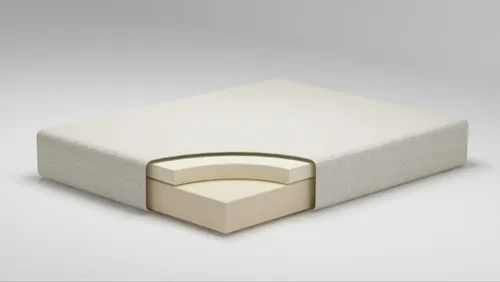
This screenshot has width=500, height=282. I want to click on art, so click(259, 188).